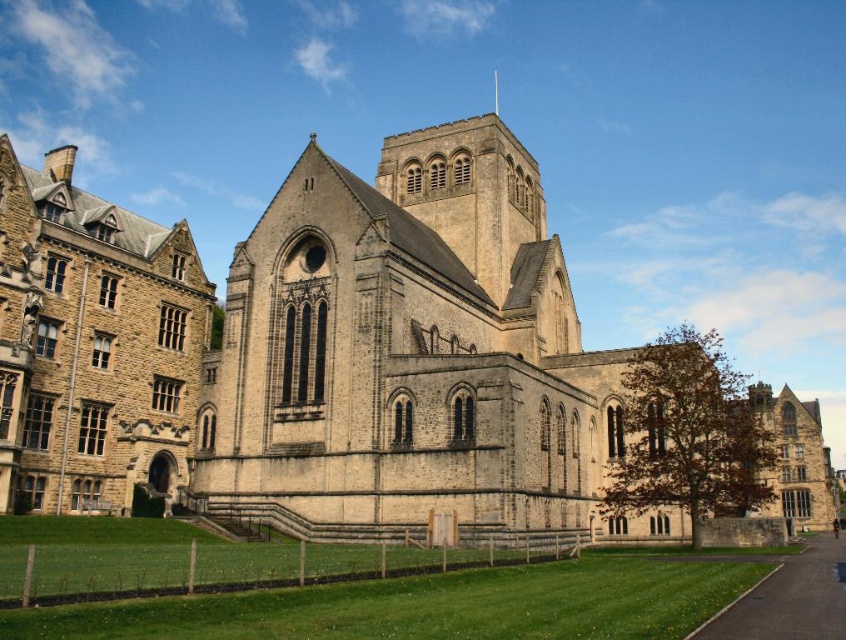
Based on the coordinates provided in the scene description, which object corresponds to the point at location (312,352)?

The point at location (312,352) corresponds to the beige stone church at center.

You are a tourist standing in front of the beige stone church at center and the stone medieval building at left. Which structure appears bigger to you?

The beige stone church at center appears bigger than the stone medieval building at left because it is larger in size.

You are standing in front of the historic building complex. You want to walk towards the beige stone church at center and the stone medieval building at left. Which one will you reach first?

The beige stone church at center is closer to you than the stone medieval building at left, so you will reach the beige stone church at center first.